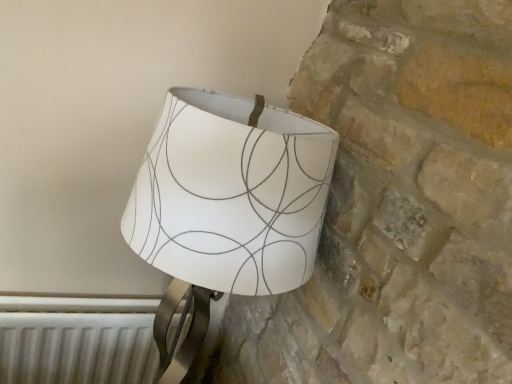
Question: From the image's perspective, is white metallic radiator at lower left located above or below white paper lampshade at upper right?

Choices:
 (A) below
 (B) above

Answer: (A)

Question: Is point click(x=15, y=380) closer or farther from the camera than point click(x=238, y=251)?

Choices:
 (A) farther
 (B) closer

Answer: (A)

Question: Considering the positions of white metallic radiator at lower left and white paper lampshade at upper right in the image, is white metallic radiator at lower left taller or shorter than white paper lampshade at upper right?

Choices:
 (A) short
 (B) tall

Answer: (A)

Question: In the image, is white paper lampshade at upper right on the left side or the right side of white metallic radiator at lower left?

Choices:
 (A) right
 (B) left

Answer: (A)

Question: Is white paper lampshade at upper right situated inside white metallic radiator at lower left or outside?

Choices:
 (A) outside
 (B) inside

Answer: (A)

Question: Considering the positions of white paper lampshade at upper right and white metallic radiator at lower left in the image, is white paper lampshade at upper right wider or thinner than white metallic radiator at lower left?

Choices:
 (A) thin
 (B) wide

Answer: (B)

Question: From the image's perspective, relative to white metallic radiator at lower left, is white paper lampshade at upper right above or below?

Choices:
 (A) below
 (B) above

Answer: (B)